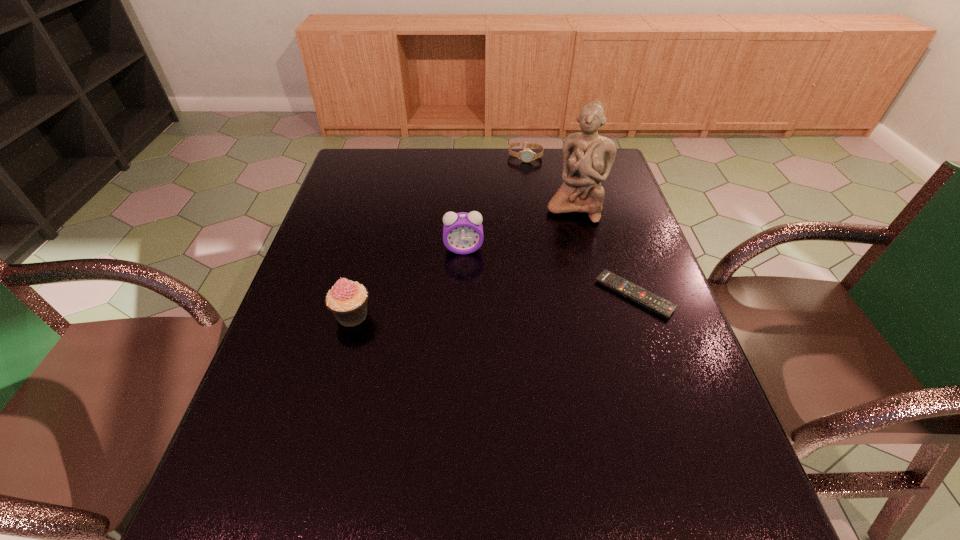
In order to click on object that is the third closest to the remote control in this screenshot , I will do `click(526, 155)`.

Locate an element on the screen. The height and width of the screenshot is (540, 960). vacant space that satisfies the following two spatial constraints: 1. on the back side of the tallest object; 2. on the right side of the cupcake is located at coordinates (381, 207).

The width and height of the screenshot is (960, 540). Identify the location of vacant space that satisfies the following two spatial constraints: 1. on the back side of the tallest object; 2. on the right side of the third farthest object. (466, 207).